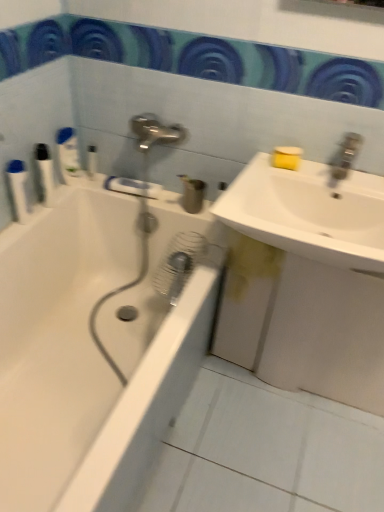
What do you see at coordinates (68, 153) in the screenshot? The image size is (384, 512). I see `white plastic bottle at upper left, acting as the 3th toiletry starting from the right` at bounding box center [68, 153].

Image resolution: width=384 pixels, height=512 pixels. What do you see at coordinates (18, 188) in the screenshot? I see `white plastic bottles at left, the first toiletry viewed from the left` at bounding box center [18, 188].

What do you see at coordinates (345, 156) in the screenshot?
I see `satin nickel faucet at upper right` at bounding box center [345, 156].

Locate an element on the screen. The height and width of the screenshot is (512, 384). matte plastic cup at center, placed as the first toiletry when sorted from right to left is located at coordinates (192, 194).

What is the approximate width of matte plastic cup at center, the 5th toiletry when ordered from left to right?

The width of matte plastic cup at center, the 5th toiletry when ordered from left to right, is 4.85 inches.

Describe the element at coordinates (92, 161) in the screenshot. I see `white plastic bottle at upper left, the fourth toiletry positioned from the left` at that location.

I want to click on white plastic towel bar at upper center, so click(132, 187).

Which is closer to the camera, (18, 205) or (307, 200)?

Point (18, 205).

Can you confirm if white plastic bottles at left, acting as the 5th toiletry starting from the right, is bigger than white glossy sink at upper right, placed as the first sink when sorted from top to bottom?

No.

Considering their positions, is white plastic bottles at left, the first toiletry viewed from the left, located in front of or behind white glossy sink at upper right, positioned as the 2th sink in bottom-to-top order?

white plastic bottles at left, the first toiletry viewed from the left, is positioned farther from the viewer than white glossy sink at upper right, positioned as the 2th sink in bottom-to-top order.

How much distance is there between matte plastic cup at center, the 5th toiletry when ordered from left to right, and white ceramic tile at lower center?

The distance of matte plastic cup at center, the 5th toiletry when ordered from left to right, from white ceramic tile at lower center is 34.07 inches.

Considering the positions of points (182, 199) and (310, 420), is point (182, 199) farther from camera compared to point (310, 420)?

Yes, it is.

In the scene shown: Is matte plastic cup at center, placed as the first toiletry when sorted from right to left, in front of or behind white ceramic tile at lower center in the image?

matte plastic cup at center, placed as the first toiletry when sorted from right to left, is behind white ceramic tile at lower center.

Considering the sizes of objects white glossy sink at upper right, positioned as the 2th sink in bottom-to-top order, and white ceramic tile at lower center in the image provided, who is wider, white glossy sink at upper right, positioned as the 2th sink in bottom-to-top order, or white ceramic tile at lower center?

Wider between the two is white ceramic tile at lower center.

Is point (243, 183) positioned before point (302, 410)?

That is True.

From the image's perspective, which one is positioned lower, white glossy sink at upper right, placed as the first sink when sorted from top to bottom, or white ceramic tile at lower center?

From the image's view, white ceramic tile at lower center is below.

Which of these two, white glossy sink at upper right, positioned as the 2th sink in bottom-to-top order, or white ceramic tile at lower center, is smaller?

white ceramic tile at lower center is smaller.

Considering the points (65, 173) and (200, 188), which point is in front, point (65, 173) or point (200, 188)?

The point (200, 188) is closer.

Could you measure the distance between white plastic bottle at upper left, the third toiletry when ordered from left to right, and matte plastic cup at center, the 5th toiletry when ordered from left to right?

Result: 17.52 inches.

Considering the sizes of objects white plastic bottle at upper left, the third toiletry when ordered from left to right, and matte plastic cup at center, the 5th toiletry when ordered from left to right, in the image provided, who is bigger, white plastic bottle at upper left, the third toiletry when ordered from left to right, or matte plastic cup at center, the 5th toiletry when ordered from left to right,?

matte plastic cup at center, the 5th toiletry when ordered from left to right, is bigger.

Is white plastic bottle at upper left, acting as the 3th toiletry starting from the right, taller than matte plastic cup at center, placed as the first toiletry when sorted from right to left?

Yes, white plastic bottle at upper left, acting as the 3th toiletry starting from the right, is taller than matte plastic cup at center, placed as the first toiletry when sorted from right to left.

Is white plastic bottle at upper left, which ranks as the second toiletry in right-to-left order, surrounding white plastic towel bar at upper center?

That's incorrect, white plastic towel bar at upper center is not inside white plastic bottle at upper left, which ranks as the second toiletry in right-to-left order.

From a real-world perspective, is white plastic bottle at upper left, which ranks as the second toiletry in right-to-left order, positioned above or below white plastic towel bar at upper center?

white plastic bottle at upper left, which ranks as the second toiletry in right-to-left order, is above white plastic towel bar at upper center.

Is white plastic bottle at upper left, the fourth toiletry positioned from the left, facing away from white plastic towel bar at upper center?

No, white plastic bottle at upper left, the fourth toiletry positioned from the left, is not facing away from white plastic towel bar at upper center.

Considering the positions of objects white plastic bottle at upper left, which ranks as the second toiletry in right-to-left order, and white plastic towel bar at upper center in the image provided, who is in front, white plastic bottle at upper left, which ranks as the second toiletry in right-to-left order, or white plastic towel bar at upper center?

→ white plastic towel bar at upper center.

Measure the distance between white glossy bathtub at left and white plastic bottle at upper left, the third toiletry when ordered from left to right.

The distance of white glossy bathtub at left from white plastic bottle at upper left, the third toiletry when ordered from left to right, is 21.59 inches.

Considering the relative sizes of white glossy bathtub at left and white plastic bottle at upper left, the third toiletry when ordered from left to right, in the image provided, is white glossy bathtub at left thinner than white plastic bottle at upper left, the third toiletry when ordered from left to right,?

In fact, white glossy bathtub at left might be wider than white plastic bottle at upper left, the third toiletry when ordered from left to right.

Considering their positions, is white glossy bathtub at left located in front of or behind white plastic bottle at upper left, the third toiletry when ordered from left to right?

white glossy bathtub at left is positioned closer to the viewer than white plastic bottle at upper left, the third toiletry when ordered from left to right.

Identify the location of bathtub on the right of white plastic bottle at upper left, the third toiletry when ordered from left to right. The width and height of the screenshot is (384, 512). (97, 343).

Based on the photo, is matte plastic cup at center, the 5th toiletry when ordered from left to right, oriented towards white plastic bottles at left, the first toiletry viewed from the left?

No, matte plastic cup at center, the 5th toiletry when ordered from left to right, does not turn towards white plastic bottles at left, the first toiletry viewed from the left.

Is point (195, 201) more distant than point (21, 204)?

Yes.

How different are the orientations of matte plastic cup at center, placed as the first toiletry when sorted from right to left, and white plastic bottles at left, acting as the 5th toiletry starting from the right, in degrees?

89.4 degrees separate the facing orientations of matte plastic cup at center, placed as the first toiletry when sorted from right to left, and white plastic bottles at left, acting as the 5th toiletry starting from the right.

The image size is (384, 512). I want to click on the 1st toiletry above the white glossy sink at upper right, positioned as the 2th sink in bottom-to-top order (from the image's perspective), so click(18, 188).

The width and height of the screenshot is (384, 512). Identify the location of ceramic tile on the right of matte plastic cup at center, placed as the first toiletry when sorted from right to left. (277, 444).

Based on their spatial positions, is white plastic bottles at left, acting as the 5th toiletry starting from the right, or white plastic bottles at left, acting as the fourth toiletry starting from the right, further from white matte sink at right, which appears as the 2th sink when viewed from the top?

white plastic bottles at left, acting as the 5th toiletry starting from the right, is positioned further to the anchor white matte sink at right, which appears as the 2th sink when viewed from the top.

When comparing their distances from white glossy bathtub at left, does white plastic towel bar at upper center or white ceramic tile at lower center seem further?

white plastic towel bar at upper center lies further to white glossy bathtub at left than the other object.

Based on their spatial positions, is white plastic bottle at upper left, the third toiletry when ordered from left to right, or satin nickel faucet at upper right further from white plastic bottle at upper left, which ranks as the second toiletry in right-to-left order?

Based on the image, satin nickel faucet at upper right appears to be further to white plastic bottle at upper left, which ranks as the second toiletry in right-to-left order.

Looking at the image, which one is located further to white plastic bottle at upper left, which ranks as the second toiletry in right-to-left order, white ceramic tile at lower center or matte plastic cup at center, placed as the first toiletry when sorted from right to left?

The object further to white plastic bottle at upper left, which ranks as the second toiletry in right-to-left order, is white ceramic tile at lower center.

From the image, which object appears to be nearer to white matte sink at right, which appears as the 2th sink when viewed from the top, white glossy bathtub at left or white plastic bottles at left, the second toiletry viewed from the left?

white glossy bathtub at left.

Considering their positions, is white plastic bottle at upper left, the third toiletry when ordered from left to right, positioned further to white plastic bottle at upper left, which ranks as the second toiletry in right-to-left order, than white plastic bottles at left, acting as the fourth toiletry starting from the right?

white plastic bottles at left, acting as the fourth toiletry starting from the right, lies further to white plastic bottle at upper left, which ranks as the second toiletry in right-to-left order, than the other object.

From the image, which object appears to be farther from satin nickel faucet at upper right, white plastic bottle at upper left, the fourth toiletry positioned from the left, or white ceramic tile at lower center?

white ceramic tile at lower center is positioned further to the anchor satin nickel faucet at upper right.

Looking at the image, which one is located closer to white glossy bathtub at left, white plastic bottle at upper left, the fourth toiletry positioned from the left, or white plastic towel bar at upper center?

white plastic towel bar at upper center lies closer to white glossy bathtub at left than the other object.

You are a GUI agent. You are given a task and a screenshot of the screen. Output one action in this format:
    pyautogui.click(x=<x>, y=<y>)
    Task: Click on the bathtub situated between white plastic bottle at upper left, which ranks as the second toiletry in right-to-left order, and white matte sink at right, which appears as the 2th sink when viewed from the top, from left to right
    
    Given the screenshot: What is the action you would take?
    pyautogui.click(x=97, y=343)

The height and width of the screenshot is (512, 384). I want to click on towel bar situated between white plastic bottle at upper left, the fourth toiletry positioned from the left, and white matte sink at right, acting as the first sink starting from the bottom, from left to right, so click(132, 187).

Identify the location of towel bar between white plastic bottles at left, the first toiletry viewed from the left, and white glossy sink at upper right, positioned as the 2th sink in bottom-to-top order, in the horizontal direction. This screenshot has width=384, height=512. (132, 187).

Where is `towel bar between white plastic bottle at upper left, the third toiletry when ordered from left to right, and white glossy sink at upper right, positioned as the 2th sink in bottom-to-top order, in the horizontal direction`? This screenshot has width=384, height=512. towel bar between white plastic bottle at upper left, the third toiletry when ordered from left to right, and white glossy sink at upper right, positioned as the 2th sink in bottom-to-top order, in the horizontal direction is located at coordinates (132, 187).